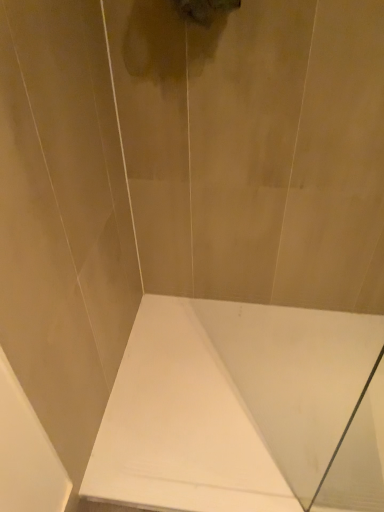
Describe the element at coordinates (229, 404) in the screenshot. I see `white matte bathtub at center` at that location.

You are a GUI agent. You are given a task and a screenshot of the screen. Output one action in this format:
    pyautogui.click(x=<x>, y=<y>)
    Task: Click on the white matte bathtub at center
    This screenshot has width=384, height=512.
    Given the screenshot: What is the action you would take?
    pyautogui.click(x=229, y=404)

You are a GUI agent. You are given a task and a screenshot of the screen. Output one action in this format:
    pyautogui.click(x=<x>, y=<y>)
    Task: Click on the white matte bathtub at center
    The height and width of the screenshot is (512, 384).
    Given the screenshot: What is the action you would take?
    click(229, 404)